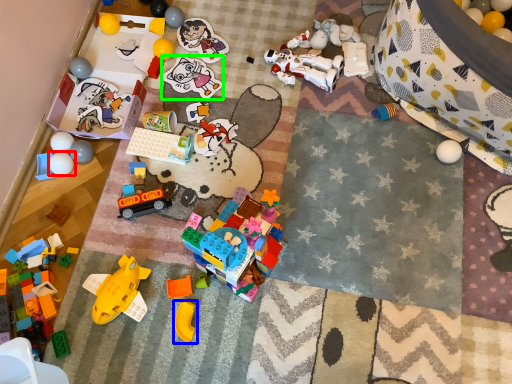
Question: Which object is positioned closest to toy (highlighted by a red box)? Select from toy (highlighted by a blue box) and toy (highlighted by a green box).

Choices:
 (A) toy
 (B) toy

Answer: (B)